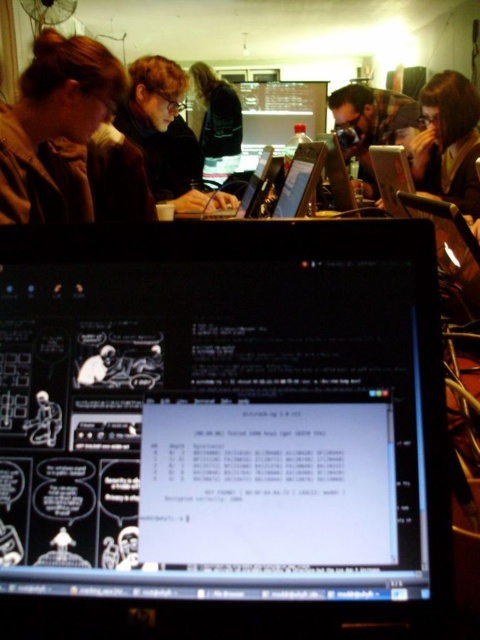
Question: Which of the following is the farthest from the observer?

Choices:
 (A) (343, 138)
 (B) (170, 170)
 (C) (459, 134)
 (D) (67, 564)

Answer: (A)

Question: Which of the following is the farthest from the observer?

Choices:
 (A) black glossy monitor at center
 (B) matte black camera at center
 (C) matte black laptop at upper right
 (D) brown fuzzy jacket at upper left

Answer: (B)

Question: Does matte black laptop at upper right have a greater width compared to matte black laptop at center?

Choices:
 (A) no
 (B) yes

Answer: (A)

Question: In this image, where is black glossy monitor at center located relative to black matte jacket at center?

Choices:
 (A) right
 (B) left

Answer: (A)

Question: Is black glossy monitor at center bigger than brown fuzzy jacket at upper left?

Choices:
 (A) no
 (B) yes

Answer: (A)

Question: Which point appears farthest from the camera in this image?

Choices:
 (A) (432, 138)
 (B) (244, 195)
 (C) (238, 557)
 (D) (85, 141)

Answer: (A)